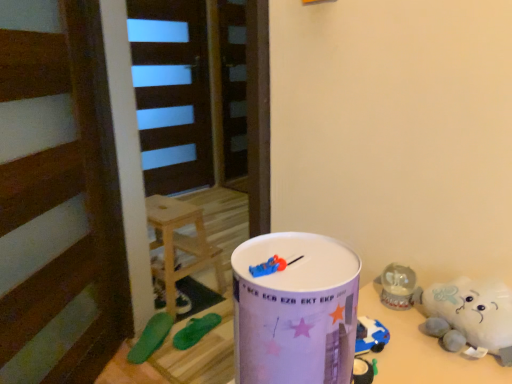
Question: Is the surface of green rubber flip-flops at lower left, the 2th toy positioned from the front, in direct contact with green rubber toy at lower left, which is the 1th toy in back-to-front order?

Choices:
 (A) yes
 (B) no

Answer: (B)

Question: Considering the relative positions of green rubber flip-flops at lower left, the 2th toy positioned from the front, and green rubber toy at lower left, arranged as the third toy when viewed from the front, in the image provided, is green rubber flip-flops at lower left, the 2th toy positioned from the front, behind green rubber toy at lower left, arranged as the third toy when viewed from the front,?

Choices:
 (A) yes
 (B) no

Answer: (B)

Question: Are green rubber flip-flops at lower left, the 2th toy viewed from the back, and green rubber toy at lower left, arranged as the third toy when viewed from the front, far apart?

Choices:
 (A) yes
 (B) no

Answer: (B)

Question: Would you say green rubber toy at lower left, which is the 1th toy in back-to-front order, is part of green rubber flip-flops at lower left, the 2th toy positioned from the front,'s contents?

Choices:
 (A) no
 (B) yes

Answer: (A)

Question: From the image's perspective, does green rubber flip-flops at lower left, the 2th toy viewed from the back, appear higher than green rubber toy at lower left, arranged as the third toy when viewed from the front?

Choices:
 (A) no
 (B) yes

Answer: (A)

Question: Is green rubber flip-flops at lower left, the 2th toy viewed from the back, facing away from green rubber toy at lower left, which is the 1th toy in back-to-front order?

Choices:
 (A) yes
 (B) no

Answer: (B)

Question: Is green rubber toy at lower left, which ranks as the first toy in front-to-back order, located within wooden stool at center?

Choices:
 (A) yes
 (B) no

Answer: (B)

Question: From the image's perspective, is wooden stool at center located beneath green rubber toy at lower left, marked as the third toy in a back-to-front arrangement?

Choices:
 (A) no
 (B) yes

Answer: (A)

Question: Is wooden stool at center to the left of green rubber toy at lower left, marked as the third toy in a back-to-front arrangement, from the viewer's perspective?

Choices:
 (A) yes
 (B) no

Answer: (B)

Question: Considering the relative sizes of wooden stool at center and green rubber toy at lower left, marked as the third toy in a back-to-front arrangement, in the image provided, is wooden stool at center taller than green rubber toy at lower left, marked as the third toy in a back-to-front arrangement,?

Choices:
 (A) no
 (B) yes

Answer: (B)

Question: Does wooden stool at center have a larger size compared to green rubber toy at lower left, marked as the third toy in a back-to-front arrangement?

Choices:
 (A) no
 (B) yes

Answer: (B)

Question: Is wooden stool at center wider than green rubber toy at lower left, marked as the third toy in a back-to-front arrangement?

Choices:
 (A) no
 (B) yes

Answer: (B)

Question: Considering the relative positions of green rubber toy at lower left, which is the 1th toy in back-to-front order, and white plush toy at lower right in the image provided, is green rubber toy at lower left, which is the 1th toy in back-to-front order, behind white plush toy at lower right?

Choices:
 (A) yes
 (B) no

Answer: (A)